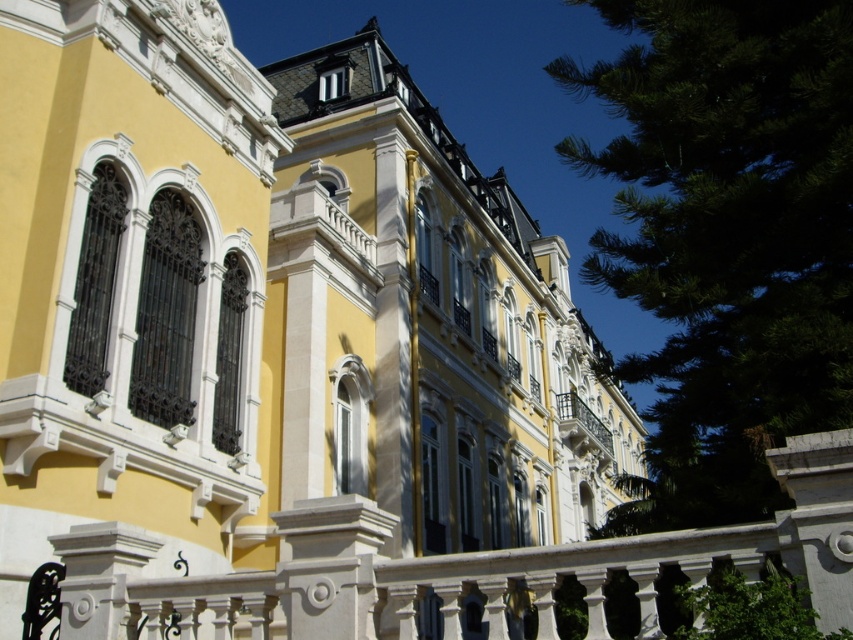
Question: Can you confirm if green leafy tree at upper right is positioned above white wrought iron balcony at center?

Choices:
 (A) no
 (B) yes

Answer: (B)

Question: Which point is farther to the camera?

Choices:
 (A) (728, 51)
 (B) (596, 422)

Answer: (B)

Question: Is green leafy tree at upper right in front of white wrought iron balcony at center?

Choices:
 (A) yes
 (B) no

Answer: (A)

Question: Can you confirm if green leafy tree at upper right is smaller than white wrought iron balcony at center?

Choices:
 (A) yes
 (B) no

Answer: (B)

Question: Which point appears farthest from the camera in this image?

Choices:
 (A) (814, 120)
 (B) (596, 428)

Answer: (B)